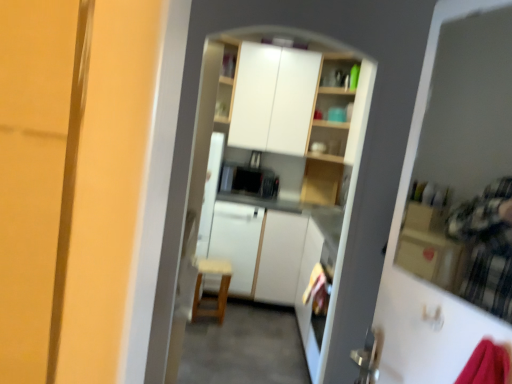
Question: In which direction should I rotate to look at white glossy cabinets at upper center, the second cabinetry positioned from the bottom?

Choices:
 (A) left
 (B) right

Answer: (B)

Question: Should I look upward or downward to see white matte cabinet at center, the second cabinetry viewed from the top?

Choices:
 (A) down
 (B) up

Answer: (A)

Question: From the image's perspective, does white matte cabinet at center, which is the 1th cabinetry from bottom to top, appear lower than wooden chair at center?

Choices:
 (A) yes
 (B) no

Answer: (B)

Question: Considering the relative sizes of white matte cabinet at center, the second cabinetry viewed from the top, and wooden chair at center in the image provided, is white matte cabinet at center, the second cabinetry viewed from the top, shorter than wooden chair at center?

Choices:
 (A) yes
 (B) no

Answer: (B)

Question: Considering the relative sizes of white matte cabinet at center, which is the 1th cabinetry from bottom to top, and wooden chair at center in the image provided, is white matte cabinet at center, which is the 1th cabinetry from bottom to top, smaller than wooden chair at center?

Choices:
 (A) yes
 (B) no

Answer: (B)

Question: From a real-world perspective, does white matte cabinet at center, the second cabinetry viewed from the top, sit lower than wooden chair at center?

Choices:
 (A) yes
 (B) no

Answer: (B)

Question: Does white matte cabinet at center, the second cabinetry viewed from the top, lie in front of wooden chair at center?

Choices:
 (A) yes
 (B) no

Answer: (B)

Question: Is white matte cabinet at center, which is the 1th cabinetry from bottom to top, touching wooden chair at center?

Choices:
 (A) no
 (B) yes

Answer: (A)

Question: Is wooden chair at center positioned in front of transparent plastic screen door at upper right?

Choices:
 (A) no
 (B) yes

Answer: (A)

Question: From a real-world perspective, is wooden chair at center beneath transparent plastic screen door at upper right?

Choices:
 (A) no
 (B) yes

Answer: (B)

Question: From a real-world perspective, is wooden chair at center physically above transparent plastic screen door at upper right?

Choices:
 (A) yes
 (B) no

Answer: (B)

Question: From the image's perspective, does wooden chair at center appear lower than transparent plastic screen door at upper right?

Choices:
 (A) yes
 (B) no

Answer: (A)

Question: Is wooden chair at center outside transparent plastic screen door at upper right?

Choices:
 (A) no
 (B) yes

Answer: (B)

Question: Is wooden chair at center thinner than transparent plastic screen door at upper right?

Choices:
 (A) yes
 (B) no

Answer: (B)

Question: Is white matte cabinet at center, which is the 1th cabinetry from bottom to top, at the back of white glossy cabinets at upper center, the second cabinetry positioned from the bottom?

Choices:
 (A) yes
 (B) no

Answer: (B)